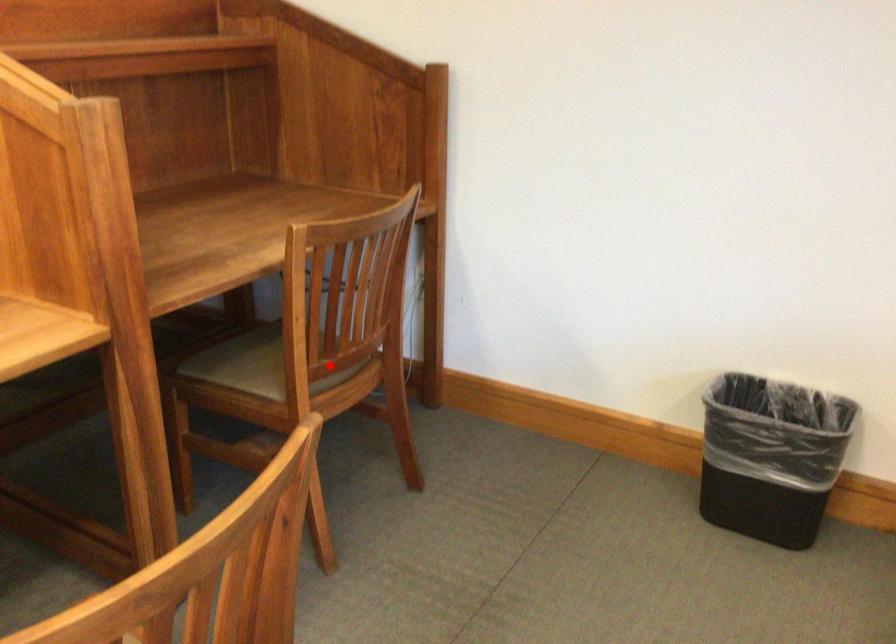
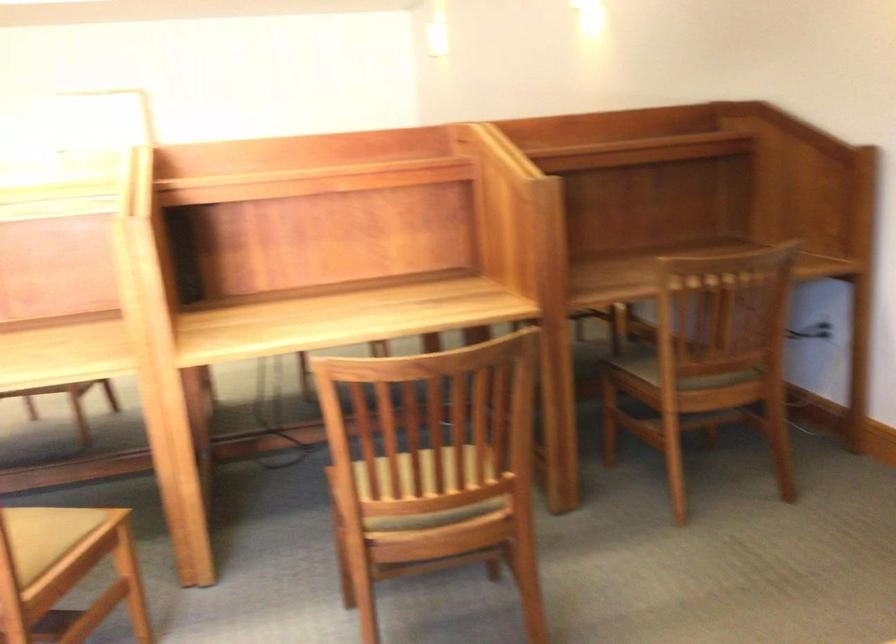
The point at the highlighted location is marked in the first image. Where is the corresponding point in the second image?

(698, 361)